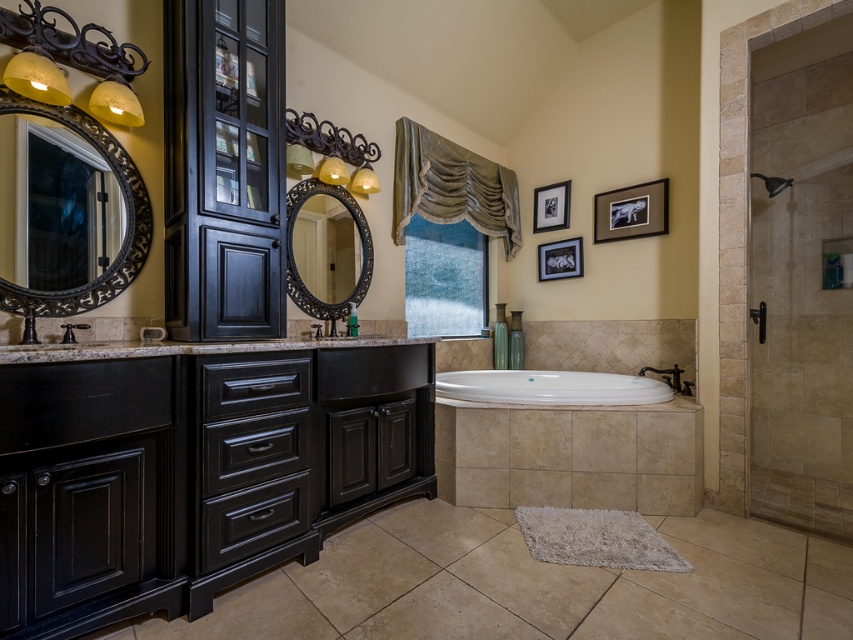
Can you confirm if white glossy bathtub at center is positioned to the right of black matte picture frame at upper center?

Incorrect, white glossy bathtub at center is not on the right side of black matte picture frame at upper center.

Does point (490, 392) come closer to viewer compared to point (538, 193)?

Yes, it is in front of point (538, 193).

The height and width of the screenshot is (640, 853). What are the coordinates of `white glossy bathtub at center` in the screenshot? It's located at click(x=550, y=387).

Is black matte picture frame at upper center to the right of black matte faucet at center from the viewer's perspective?

Correct, you'll find black matte picture frame at upper center to the right of black matte faucet at center.

Can you confirm if black matte picture frame at upper center is positioned to the left of black matte faucet at center?

In fact, black matte picture frame at upper center is to the right of black matte faucet at center.

Does point (550, 205) come in front of point (329, 333)?

No, it is not.

Find the location of a particular element. black matte picture frame at upper center is located at coordinates (550, 205).

Consider the image. Is matte black mirror at left positioned in front of black matte picture frame at upper right?

Yes, it is in front of black matte picture frame at upper right.

Is point (22, 106) positioned after point (611, 220)?

That is False.

What do you see at coordinates (125, 204) in the screenshot? I see `matte black mirror at left` at bounding box center [125, 204].

Locate an element on the screen. The image size is (853, 640). matte black mirror at left is located at coordinates (125, 204).